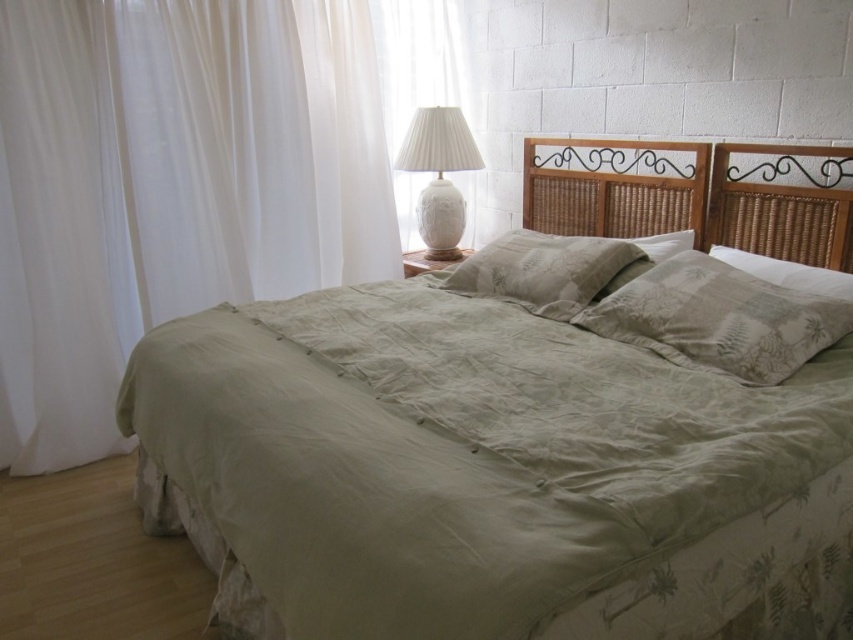
Between rattan wood headboard at center and sage green fabric pillow at right, which one has more height?

With more height is rattan wood headboard at center.

Who is more forward, (676, 189) or (828, 284)?

Point (828, 284) is more forward.

You are a GUI agent. You are given a task and a screenshot of the screen. Output one action in this format:
    pyautogui.click(x=<x>, y=<y>)
    Task: Click on the rattan wood headboard at center
    
    Given the screenshot: What is the action you would take?
    pyautogui.click(x=614, y=186)

Who is more distant from viewer, (798,244) or (395,125)?

Positioned behind is point (395,125).

Is point (810, 260) farther from camera compared to point (444, 83)?

That is False.

Is point (817, 234) in front of point (376, 44)?

Yes, it is.

You are a GUI agent. You are given a task and a screenshot of the screen. Output one action in this format:
    pyautogui.click(x=<x>, y=<y>)
    Task: Click on the woven wood headboard at upper right
    Image resolution: width=853 pixels, height=640 pixels.
    Given the screenshot: What is the action you would take?
    pyautogui.click(x=782, y=202)

Can you confirm if woven wood headboard at upper right is positioned above sage green fabric pillow at right?

Yes, woven wood headboard at upper right is above sage green fabric pillow at right.

Does point (838, 168) lie behind point (784, 266)?

No, (838, 168) is closer to viewer.

This screenshot has width=853, height=640. What are the coordinates of `woven wood headboard at upper right` in the screenshot? It's located at (782, 202).